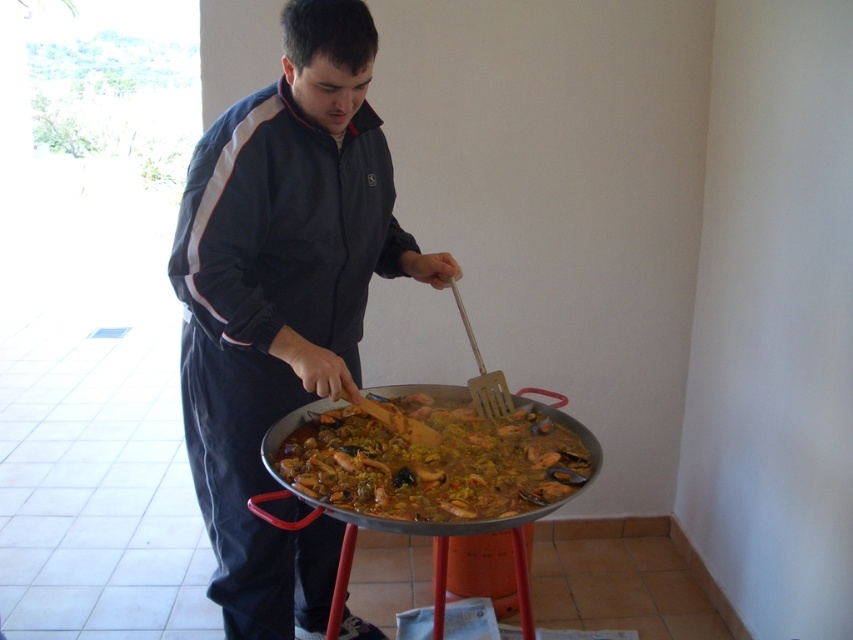
Is dark blue track suit at center shorter than yellow rice at center?

Incorrect, dark blue track suit at center's height does not fall short of yellow rice at center's.

Who is more distant from viewer, (252, 161) or (506, 440)?

The point (506, 440) is more distant.

Which is in front, point (202, 188) or point (558, 500)?

Point (558, 500) is more forward.

At what (x,y) coordinates should I click in order to perform the action: click on dark blue track suit at center. Please return your answer as a coordinate pair (x, y). This screenshot has width=853, height=640. Looking at the image, I should click on (282, 298).